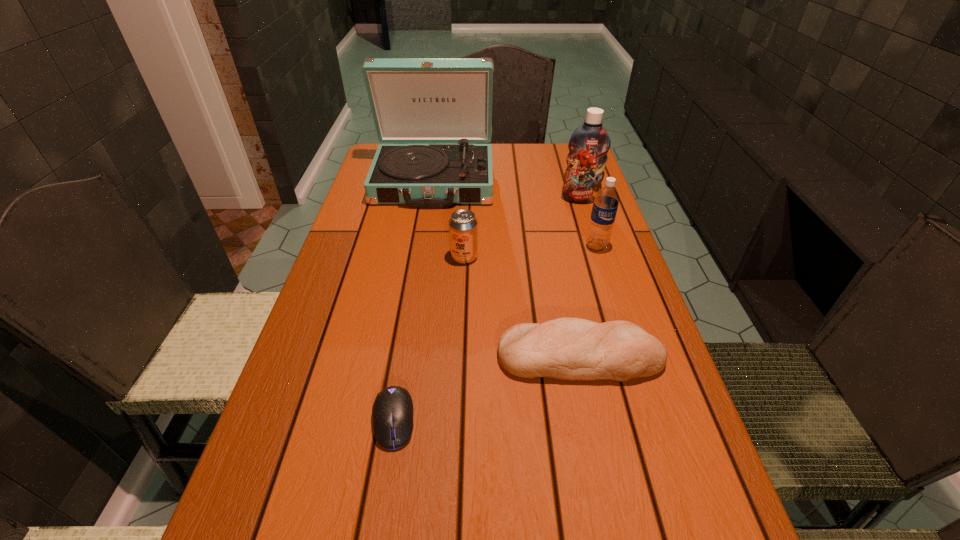
At what (x,y) coordinates should I click in order to perform the action: click on blank area located on the front of the water bottle. Please return your answer as a coordinate pair (x, y). Image resolution: width=960 pixels, height=540 pixels. Looking at the image, I should click on (609, 286).

You are a GUI agent. You are given a task and a screenshot of the screen. Output one action in this format:
    pyautogui.click(x=<x>, y=<y>)
    Task: Click on the vacant region located 0.060m on the left of the fourth tallest object
    Image resolution: width=960 pixels, height=540 pixels.
    Given the screenshot: What is the action you would take?
    pyautogui.click(x=427, y=257)

This screenshot has width=960, height=540. What are the coordinates of `vacant area situated on the back of the second nearest object` in the screenshot? It's located at (557, 247).

This screenshot has width=960, height=540. What are the coordinates of `free space located on the back of the nearest object` in the screenshot? It's located at (415, 289).

Locate an element on the screen. object that is positioned at the far edge is located at coordinates (413, 100).

Image resolution: width=960 pixels, height=540 pixels. Find the location of `object present at the left edge`. object present at the left edge is located at coordinates (413, 100).

Image resolution: width=960 pixels, height=540 pixels. What are the coordinates of `shampoo present at the right edge` in the screenshot? It's located at (589, 144).

The height and width of the screenshot is (540, 960). In order to click on water bottle located in the right edge section of the desktop in this screenshot , I will do click(606, 201).

The image size is (960, 540). What are the coordinates of `bread present at the right edge` in the screenshot? It's located at (566, 348).

Find the location of a particular element. This screenshot has height=540, width=960. object that is at the far left corner is located at coordinates (413, 100).